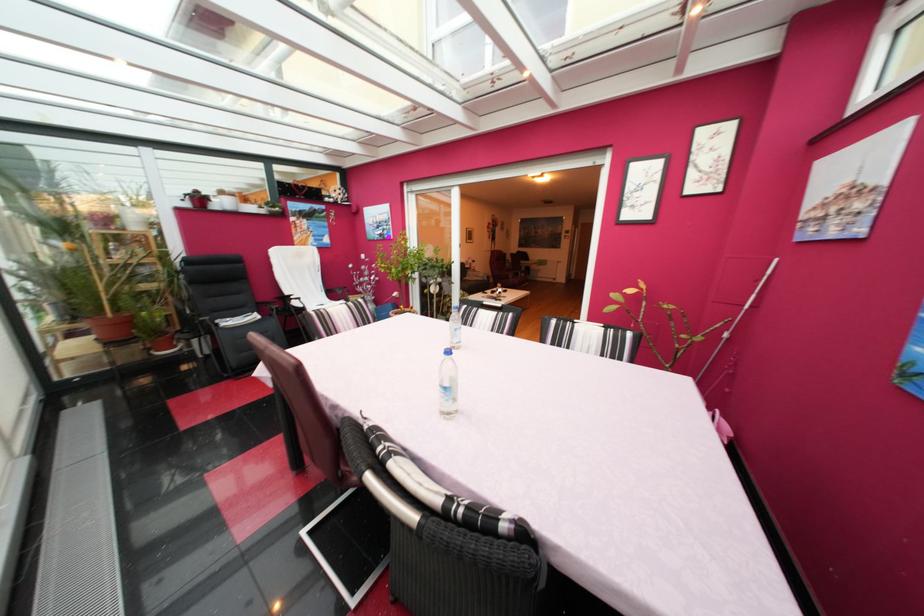
Describe the element at coordinates (237, 317) in the screenshot. This screenshot has height=616, width=924. I see `the black chair sitting surface` at that location.